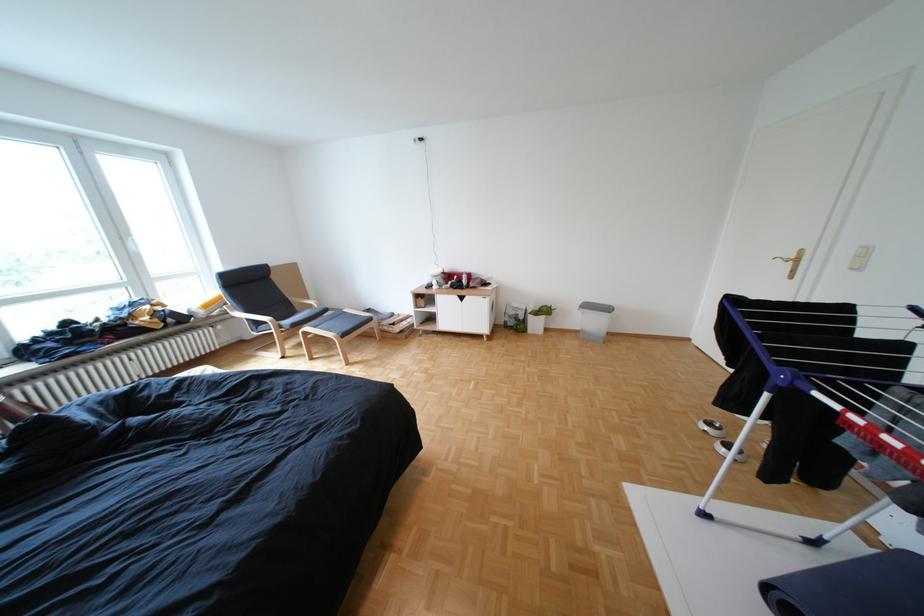
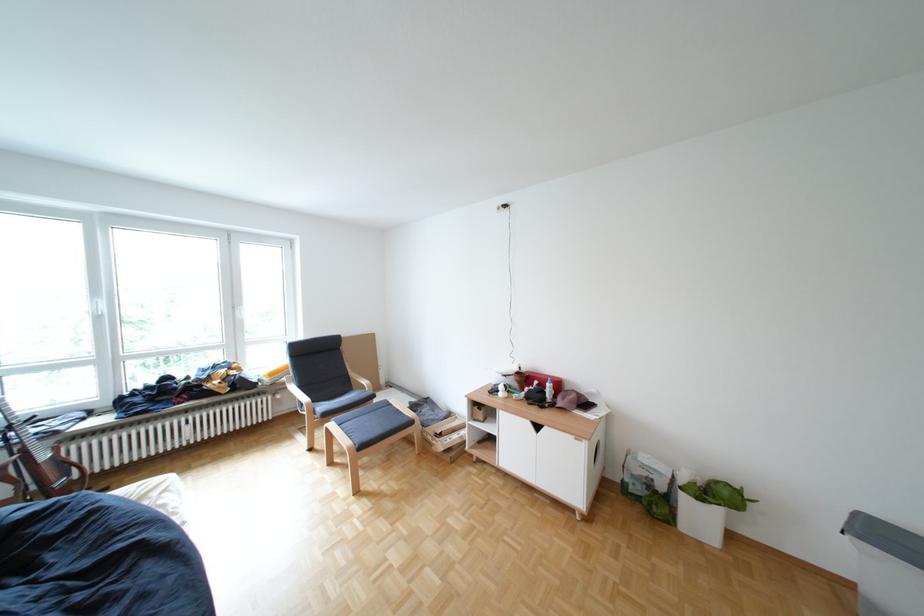
In the second image, find the point that corresponds to [322,329] in the first image.

(346, 424)